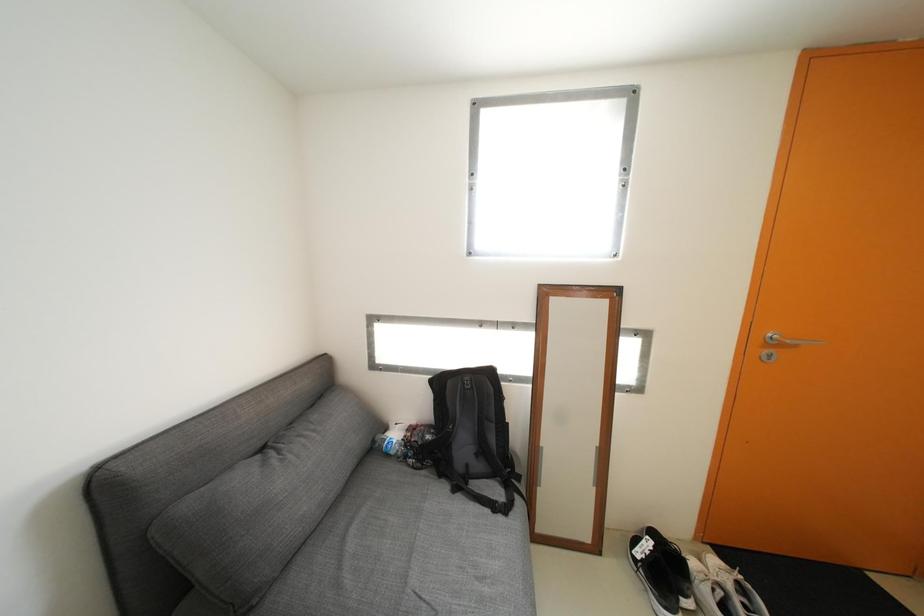
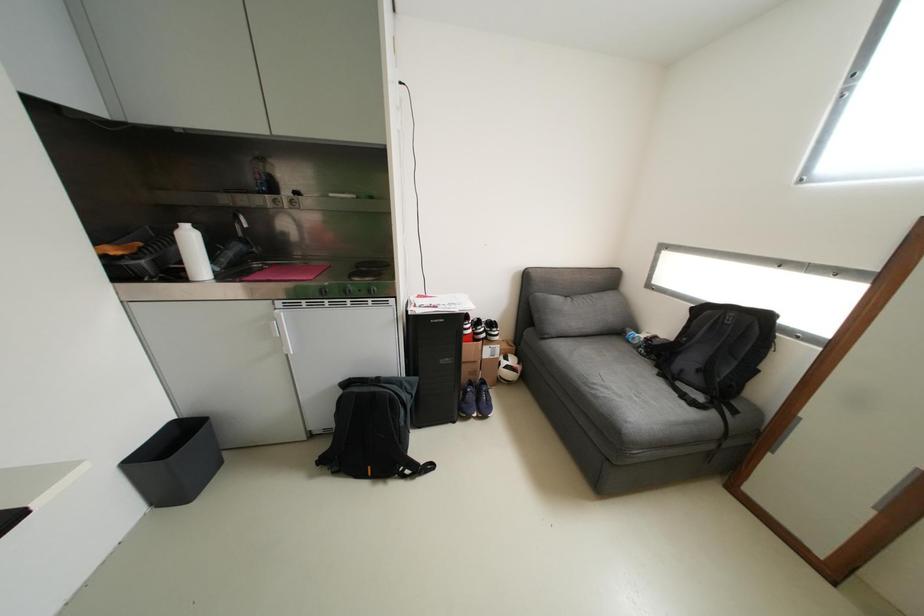
Based on the continuous images, in which direction is the camera rotating?

The rotation direction of the camera is left-down.